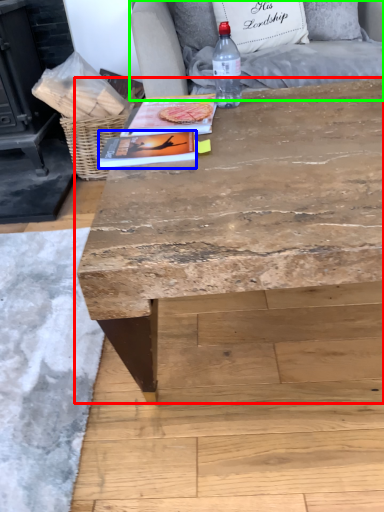
Question: Based on their relative distances, which object is farther from table (highlighted by a red box)? Choose from magazine (highlighted by a blue box) and armchair (highlighted by a green box).

Choices:
 (A) magazine
 (B) armchair

Answer: (B)